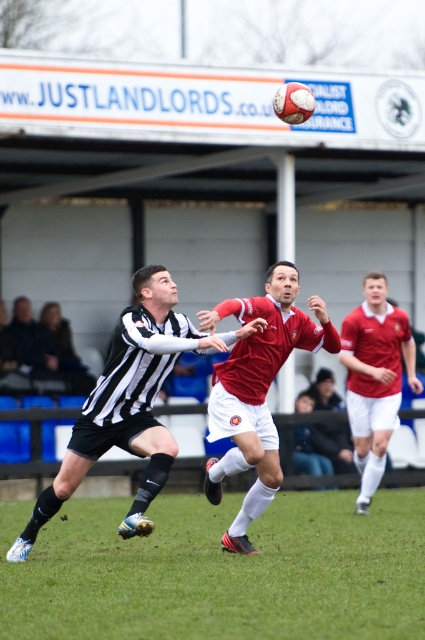
You are a soccer player positioned at the edge of the field. You see the green grass at center and the black and white striped jersey at center. Which object is closer to your current position?

The black and white striped jersey at center is closer to your current position because the green grass at center is to the right of the black and white striped jersey at center, meaning the jersey is positioned more towards the center while the grass is further to the right.

You are a soccer fan watching the match. You notice the green grass at center and the black and white striped jersey at center. Which one is closer to you?

The green grass at center is closer to the viewer than the black and white striped jersey at center.

You are a soccer coach observing the game. You notice the green grass at center and the red matte soccer player at center. Which object is closer to the camera in the image?

The green grass at center is in front of the red matte soccer player at center, so the green grass at center is closer to the camera.